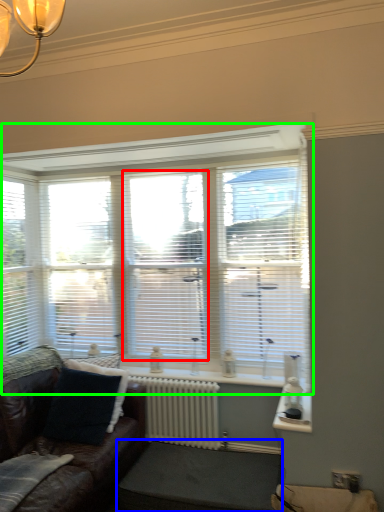
Question: Considering the real-world distances, which object is farthest from glass door (highlighted by a red box)? footrest (highlighted by a blue box) or window (highlighted by a green box)?

Choices:
 (A) footrest
 (B) window

Answer: (A)